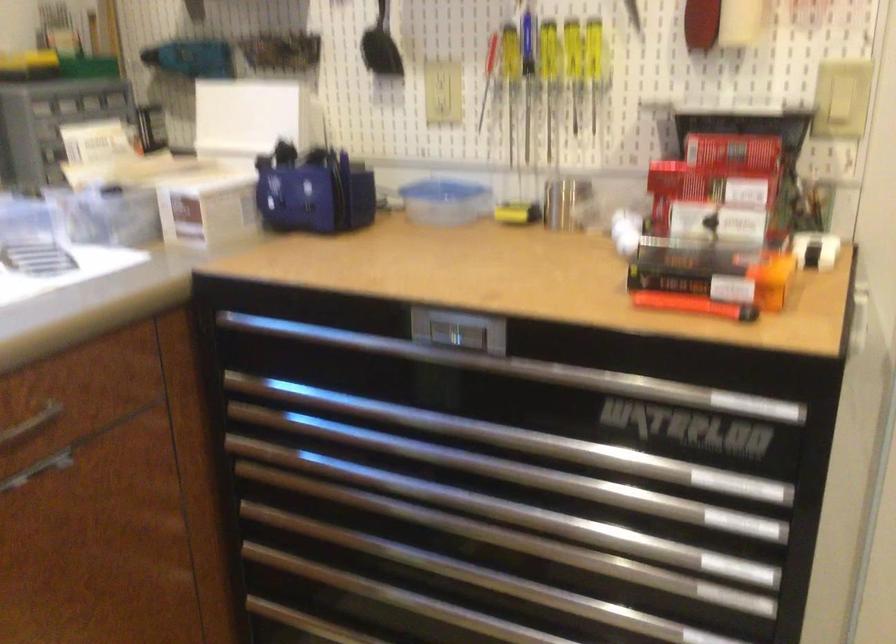
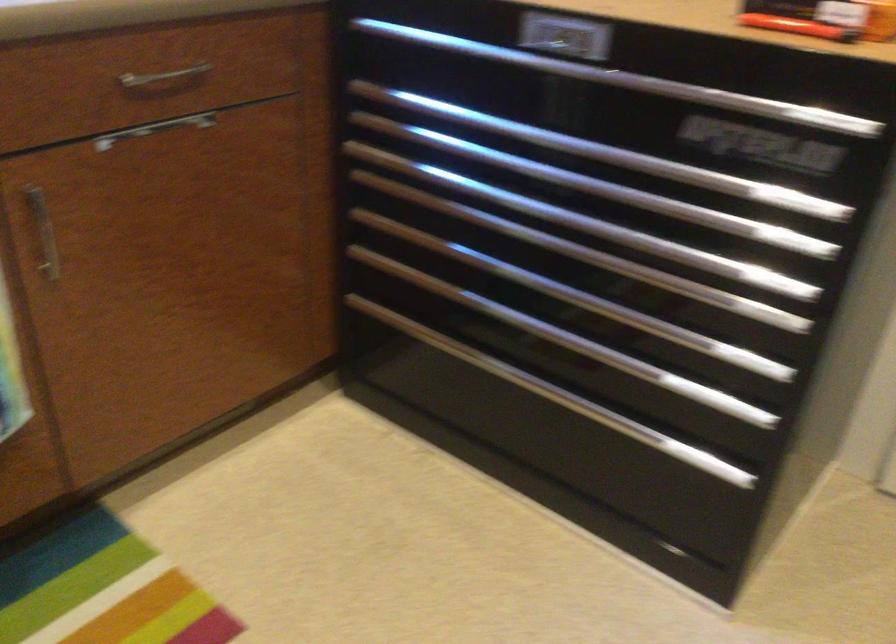
Locate, in the second image, the point that corresponds to (x=600, y=488) in the first image.

(666, 205)